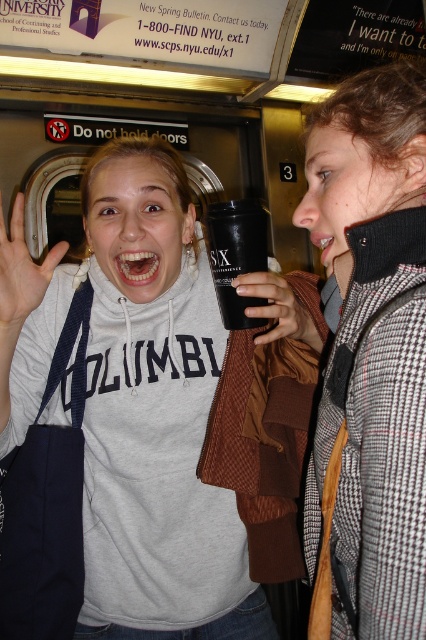
Between light skin tone hand at center and matte black cup at center, which one is positioned lower?

matte black cup at center is below.

Is point (25, 300) farther from camera compared to point (304, 340)?

That is False.

Identify the location of light skin tone hand at center. This screenshot has height=640, width=426. (22, 272).

Does black matte cup at center lie behind light skin tone hand at center?

That is True.

Is black matte cup at center taller than light skin tone hand at center?

No.

This screenshot has height=640, width=426. Describe the element at coordinates (236, 256) in the screenshot. I see `black matte cup at center` at that location.

The height and width of the screenshot is (640, 426). Find the location of `black matte cup at center`. black matte cup at center is located at coordinates (236, 256).

Between gray sweatshirt at center and black matte cup at center, which one is positioned lower?

gray sweatshirt at center is lower down.

Can you confirm if gray sweatshirt at center is taller than black matte cup at center?

Yes.

Which is behind, point (238, 518) or point (230, 208)?

Positioned behind is point (238, 518).

The image size is (426, 640). Identify the location of gray sweatshirt at center. (135, 419).